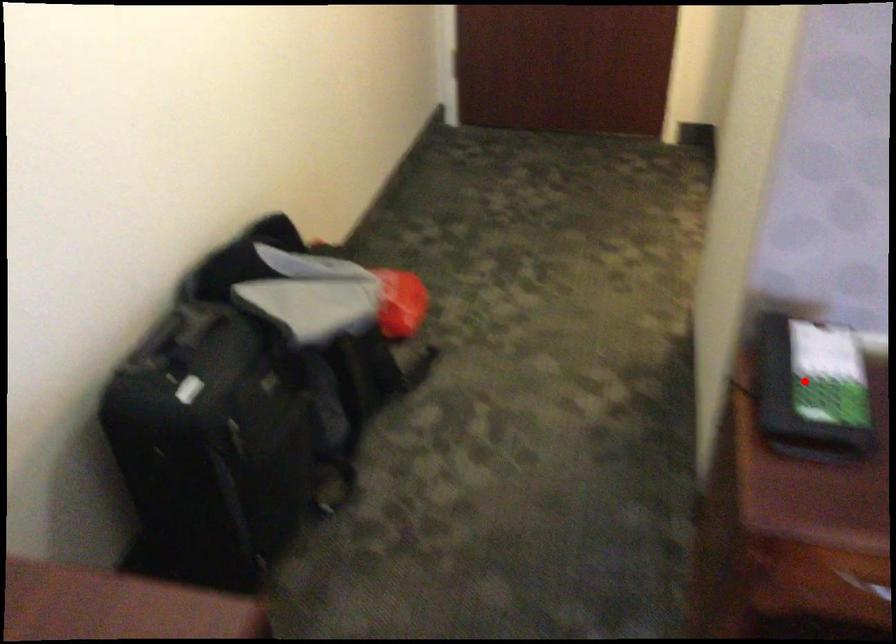
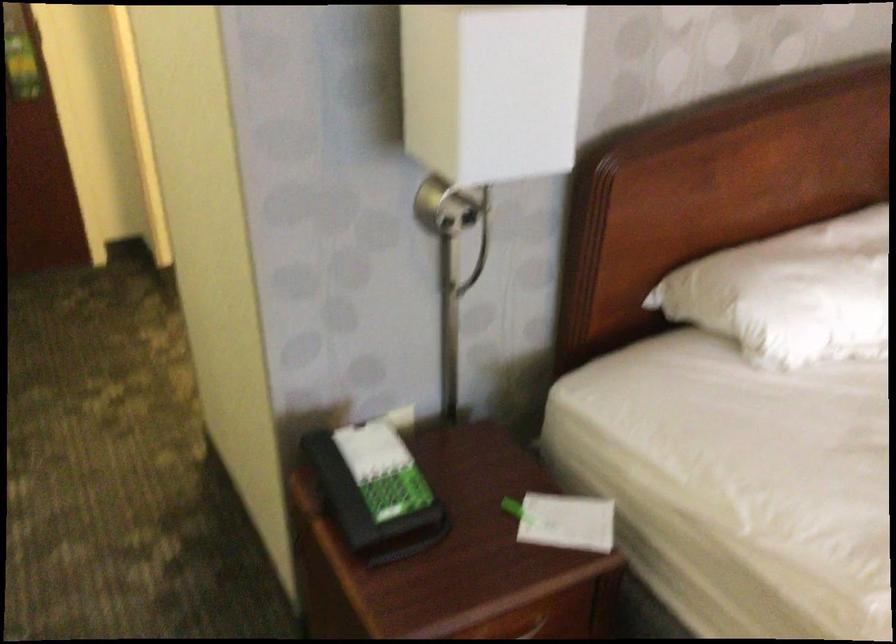
Locate, in the second image, the point that corresponds to the highlighted location in the first image.

(375, 491)